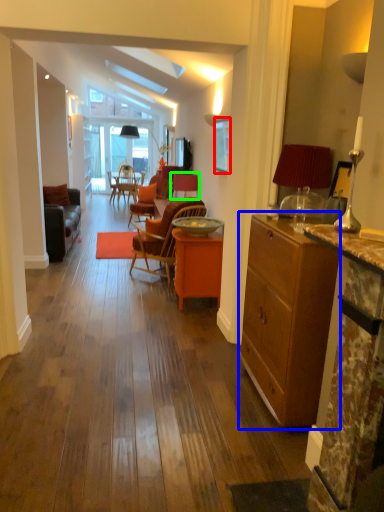
Question: Which is farther away from picture frame (highlighted by a red box)? cabinetry (highlighted by a blue box) or chair (highlighted by a green box)?

Choices:
 (A) cabinetry
 (B) chair

Answer: (A)